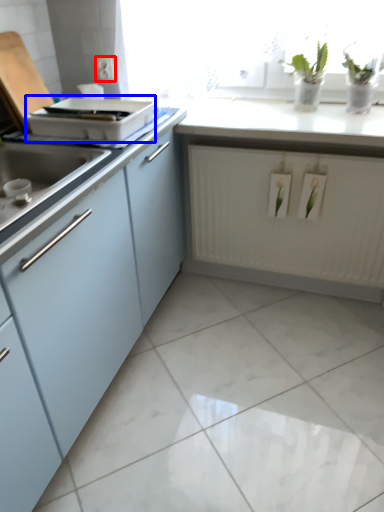
Question: Which object is further to the camera taking this photo, electric outlet (highlighted by a red box) or appliance (highlighted by a blue box)?

Choices:
 (A) electric outlet
 (B) appliance

Answer: (A)